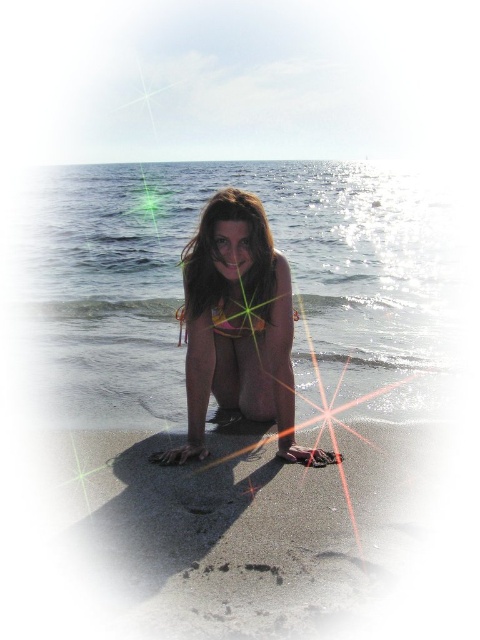
Question: Which object appears closest to the camera in this image?

Choices:
 (A) orange bikini at center
 (B) smooth golden sand at lower center

Answer: (B)

Question: Is smooth golden sand at lower center below orange bikini at center?

Choices:
 (A) no
 (B) yes

Answer: (B)

Question: Can you confirm if smooth golden sand at lower center is positioned above orange bikini at center?

Choices:
 (A) no
 (B) yes

Answer: (A)

Question: Does smooth golden sand at lower center appear on the right side of orange bikini at center?

Choices:
 (A) no
 (B) yes

Answer: (B)